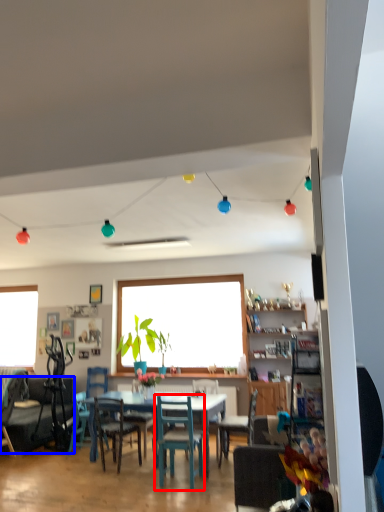
Question: Which of the following is the closest to the observer, chair (highlighted by a red box) or studio couch (highlighted by a blue box)?

Choices:
 (A) chair
 (B) studio couch

Answer: (A)